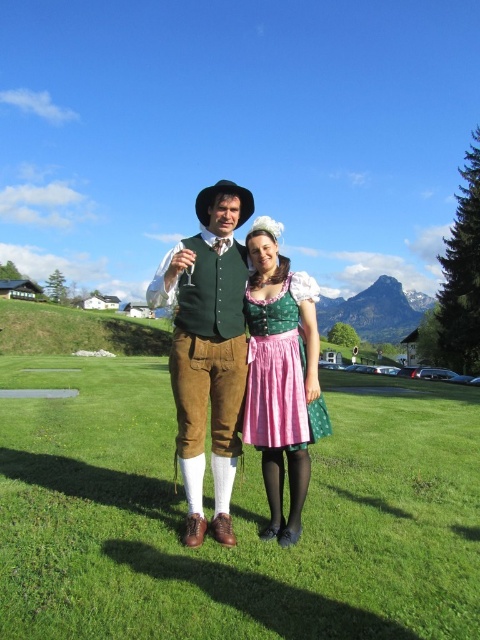
Which is below, green velvety vest at center or green satin dirndl at center?

green satin dirndl at center is below.

Looking at this image, is green velvety vest at center wider than green satin dirndl at center?

Correct, the width of green velvety vest at center exceeds that of green satin dirndl at center.

This screenshot has height=640, width=480. I want to click on green velvety vest at center, so click(208, 348).

Is green grass at center thinner than green satin dirndl at center?

In fact, green grass at center might be wider than green satin dirndl at center.

This screenshot has width=480, height=640. I want to click on green grass at center, so click(232, 516).

Identify the location of green grass at center. The width and height of the screenshot is (480, 640). (232, 516).

Where is `green grass at center`? The width and height of the screenshot is (480, 640). green grass at center is located at coordinates (232, 516).

Is the position of green grass at center more distant than that of green velvety vest at center?

No.

Between point (86, 504) and point (207, 202), which one is positioned in front?

Point (86, 504) is more forward.

At what (x,y) coordinates should I click in order to perform the action: click on green grass at center. Please return your answer as a coordinate pair (x, y). The height and width of the screenshot is (640, 480). Looking at the image, I should click on (232, 516).